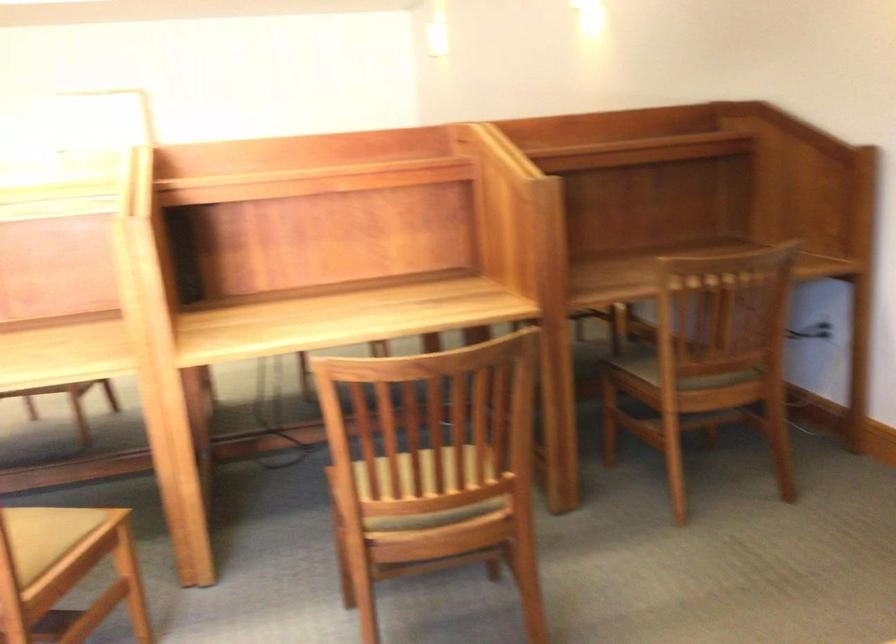
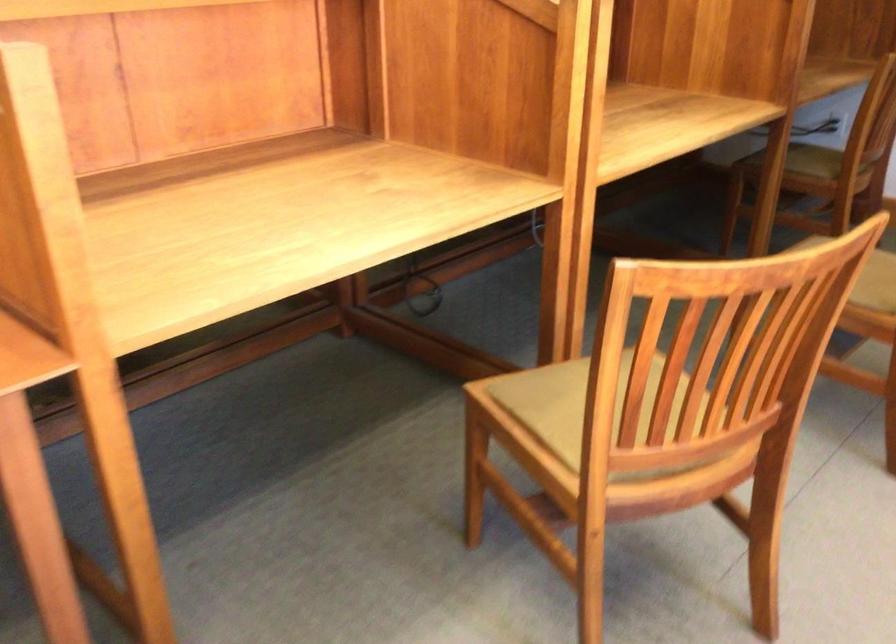
Where in the second image is the point corresponding to pixel 619 375 from the first image?

(814, 161)